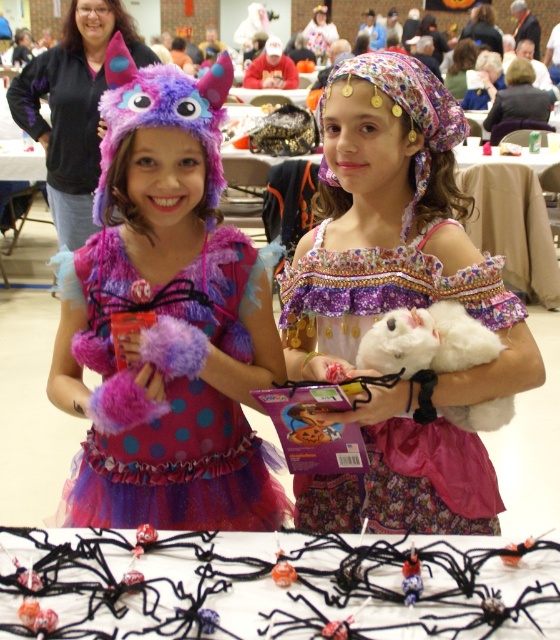
You are a photographer trying to capture a clear photo of both the floral satin dress at center and the white fluffy stuffed animal at center. Which object should you focus on first to ensure it appears sharp in the photo?

The floral satin dress at center is closer to the viewer than the white fluffy stuffed animal at center, so you should focus on the floral satin dress at center first to ensure it appears sharp in the photo.

You are a photographer at a Halloween party and need to position the black fabric spider web at lower center and the floral satin dress at center in your shot. Which object should you move to the right to ensure both are centered in your frame?

The black fabric spider web at lower center is to the left of the floral satin dress at center. To center both objects, move the black fabric spider web at lower center to the right so it aligns with the floral satin dress at center.

You are a photographer at a childrens party and need to capture a photo of both the floral satin dress at center and the white fluffy stuffed animal at center. Based on their positions, which one is to the left?

The floral satin dress at center is positioned on the left side of the white fluffy stuffed animal at center, so it is to the left.